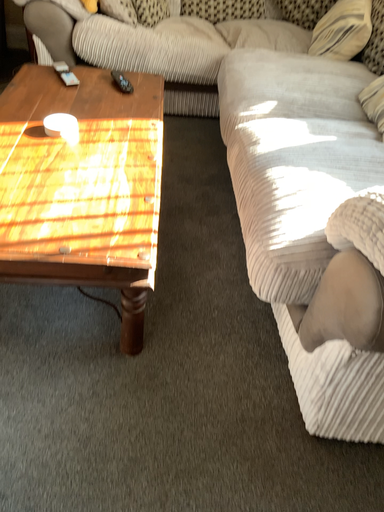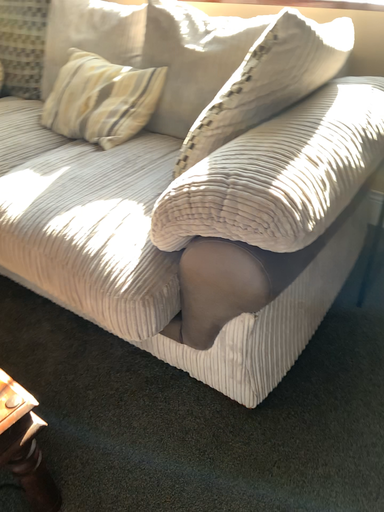
Question: Which way did the camera rotate in the video?

Choices:
 (A) rotated right
 (B) rotated left

Answer: (A)